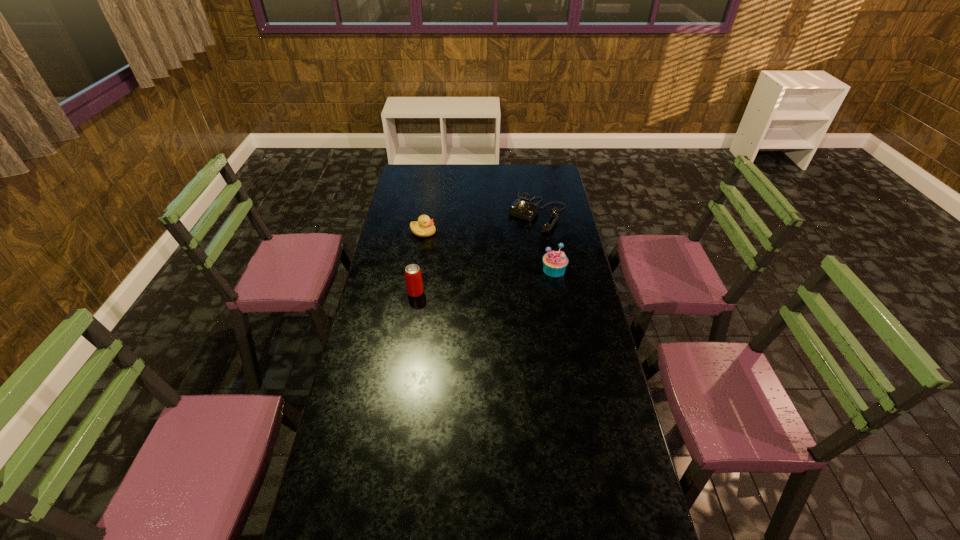
At what (x,y) coordinates should I click in order to perform the action: click on beer can. Please return your answer as a coordinate pair (x, y). Looking at the image, I should click on (413, 277).

This screenshot has width=960, height=540. I want to click on the third farthest object, so click(x=554, y=262).

Locate an element on the screen. duckling is located at coordinates (424, 227).

Where is `telephone`? telephone is located at coordinates (522, 208).

I want to click on vacant space located on the back of the nearest object, so click(x=420, y=266).

At what (x,y) coordinates should I click in order to perform the action: click on vacant space located 0.360m on the left of the second nearest object. Please return your answer as a coordinate pair (x, y). The height and width of the screenshot is (540, 960). Looking at the image, I should click on (459, 270).

Find the location of a particular element. This screenshot has height=540, width=960. vacant space situated on the beak of the duckling is located at coordinates pos(467,261).

This screenshot has width=960, height=540. In order to click on free space located on the beak of the duckling in this screenshot , I will do `click(484, 273)`.

The width and height of the screenshot is (960, 540). I want to click on vacant space situated on the beak of the duckling, so click(484, 273).

Locate an element on the screen. The image size is (960, 540). vacant space situated 0.180m on the dial of the telephone is located at coordinates (510, 253).